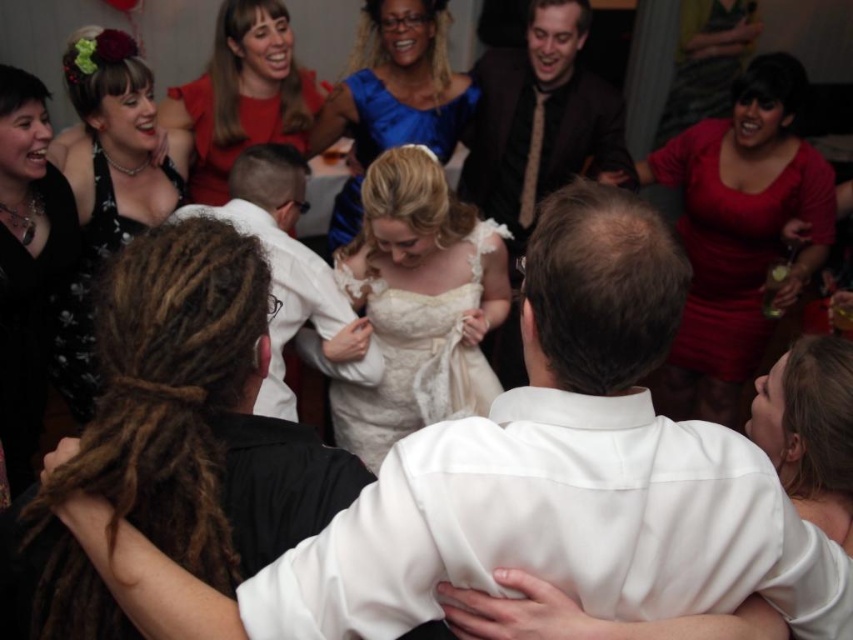
Question: Which of the following is the closest to the observer?

Choices:
 (A) white satin shirt at center
 (B) lace/embroidered dress at center

Answer: (A)

Question: Is lace/embroidered dress at center to the left of matte red dress at upper left from the viewer's perspective?

Choices:
 (A) yes
 (B) no

Answer: (B)

Question: Can you confirm if black lace dress at upper left is wider than smooth white dress at lower right?

Choices:
 (A) yes
 (B) no

Answer: (A)

Question: Based on their relative distances, which object is farther from the white satin shirt at center?

Choices:
 (A) matte red dress at upper left
 (B) lace/embroidered dress at center
 (C) shiny red dress at upper right

Answer: (C)

Question: Does black lace dress at upper left appear over smooth white dress at lower right?

Choices:
 (A) no
 (B) yes

Answer: (B)

Question: Considering the real-world distances, which object is farthest from the shiny red dress at upper right?

Choices:
 (A) matte red dress at upper left
 (B) lace/embroidered dress at center
 (C) satin blue dress at center
 (D) black lace dress at left

Answer: (D)